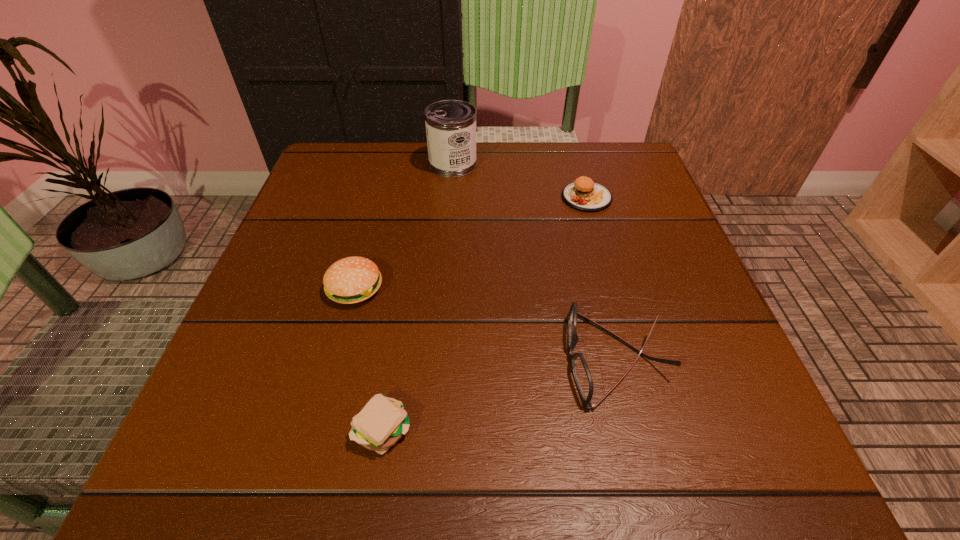
Locate an element on the screen. This screenshot has height=540, width=960. the rightmost patty is located at coordinates (564, 424).

I want to click on the farthest patty, so click(x=564, y=424).

Identify the location of spectacles. (357, 146).

Find the location of a particular element. The image size is (960, 540). the leftmost patty is located at coordinates (506, 223).

Locate an element on the screen. the second nearest patty is located at coordinates (506, 223).

Locate an element on the screen. The image size is (960, 540). the second patty from left to right is located at coordinates (644, 185).

In order to click on the nearest patty in this screenshot , I will do `click(644, 185)`.

Where is `vacant area located on the left of the rightmost patty`? This screenshot has height=540, width=960. vacant area located on the left of the rightmost patty is located at coordinates point(404,198).

The width and height of the screenshot is (960, 540). Identify the location of vacant region located on the front-facing side of the spectacles. (329, 359).

Locate an element on the screen. This screenshot has width=960, height=540. free space located on the front-facing side of the spectacles is located at coordinates (381, 359).